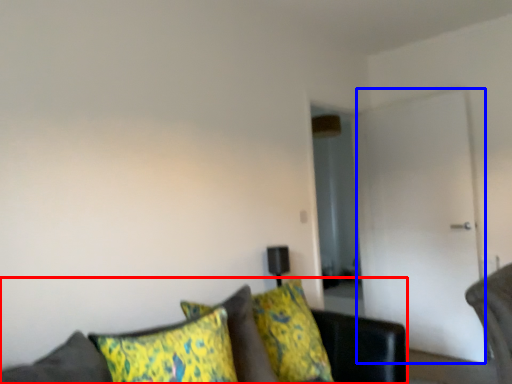
Question: Among these objects, which one is nearest to the camera, studio couch (highlighted by a red box) or glass door (highlighted by a blue box)?

Choices:
 (A) studio couch
 (B) glass door

Answer: (A)